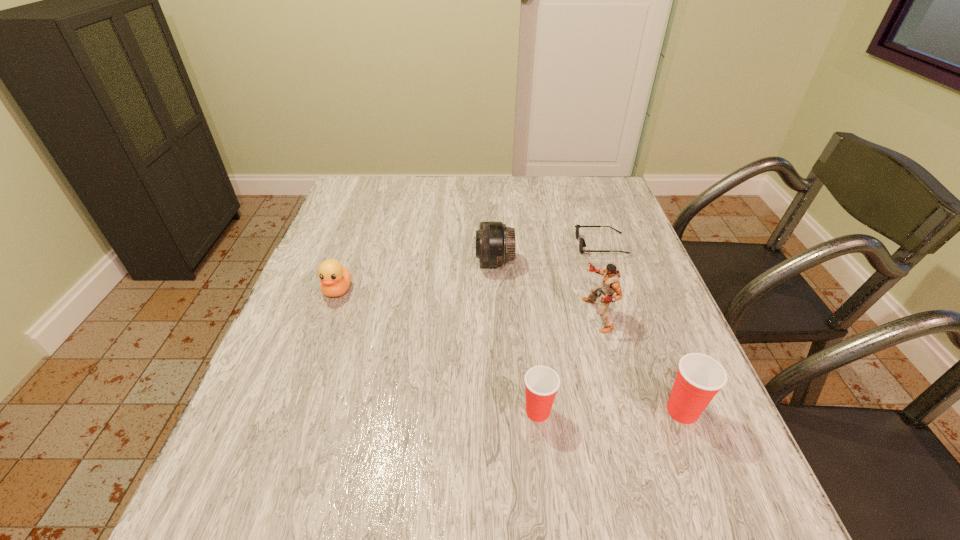
This screenshot has width=960, height=540. I want to click on the left Dixie cup, so click(x=541, y=382).

This screenshot has height=540, width=960. I want to click on the taller Dixie cup, so click(699, 378).

This screenshot has width=960, height=540. Identify the location of sunglasses. (582, 243).

You are a GUI agent. You are given a task and a screenshot of the screen. Output one action in this format:
    pyautogui.click(x=<x>, y=<y>)
    Task: Click on the telephoto lens
    Image resolution: width=960 pixels, height=540 pixels.
    Given the screenshot: What is the action you would take?
    pyautogui.click(x=495, y=243)

Where is `the tallest object`? the tallest object is located at coordinates (610, 283).

The width and height of the screenshot is (960, 540). I want to click on duckling, so click(335, 279).

Locate an element on the screen. vacant space situated on the left of the shorter Dixie cup is located at coordinates (469, 411).

Identify the location of vacant space situated 0.080m on the left of the taller Dixie cup. This screenshot has width=960, height=540. (620, 411).

Identify the location of vacant area situated 0.300m on the front-facing side of the shortest object. Image resolution: width=960 pixels, height=540 pixels. (471, 245).

This screenshot has height=540, width=960. Find the location of `vacant space located 0.070m on the front-facing side of the shortest object`. vacant space located 0.070m on the front-facing side of the shortest object is located at coordinates (552, 245).